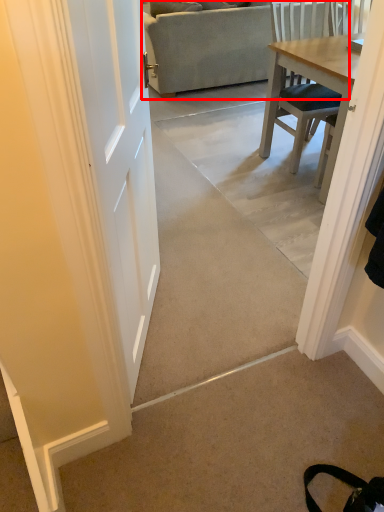
Question: From the image, what is the correct spatial relationship of studio couch (annotated by the red box) in relation to concrete?

Choices:
 (A) right
 (B) left

Answer: (A)